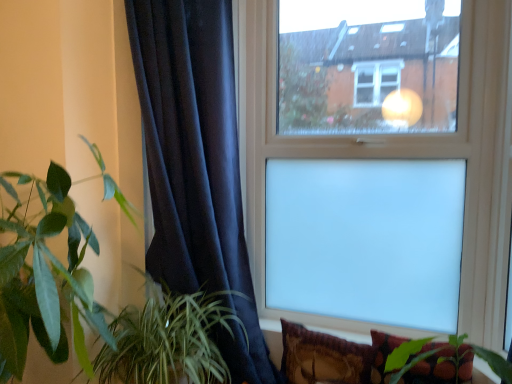
Question: Is point (377, 334) positioned closer to the camera than point (165, 9)?

Choices:
 (A) farther
 (B) closer

Answer: (A)

Question: From the image's perspective, is velvet floral pillow at lower right, which is counted as the first pillow, starting from the right, above or below velvet dark blue curtain at left?

Choices:
 (A) above
 (B) below

Answer: (B)

Question: Which of these objects is positioned farthest from the green leafy plant at left, acting as the first houseplant starting from the left?

Choices:
 (A) velvet floral pillow at lower right, which is counted as the first pillow, starting from the right
 (B) velvet-like brown pillow at lower right, placed as the 1th pillow when sorted from left to right
 (C) transparent glass window at upper center
 (D) velvet dark blue curtain at left
 (E) green leafy plant at lower left, the 1th houseplant viewed from the right

Answer: (C)

Question: Considering the real-world distances, which object is closest to the transparent glass window at upper center?

Choices:
 (A) velvet floral pillow at lower right, which is counted as the first pillow, starting from the right
 (B) velvet dark blue curtain at left
 (C) green leafy plant at lower left, the 1th houseplant viewed from the right
 (D) green leafy plant at left, acting as the first houseplant starting from the left
 (E) velvet-like brown pillow at lower right, positioned as the 2th pillow in right-to-left order

Answer: (E)